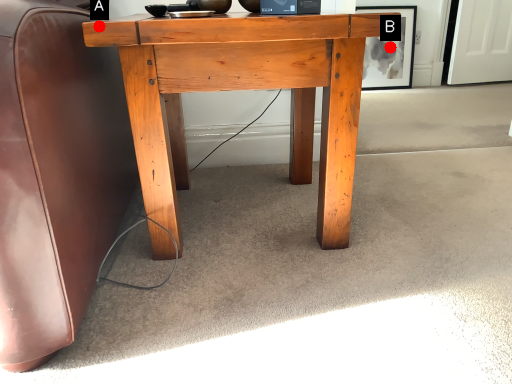
Question: Two points are circled on the image, labeled by A and B beside each circle. Among these points, which one is nearest to the camera?

Choices:
 (A) A is closer
 (B) B is closer

Answer: (A)